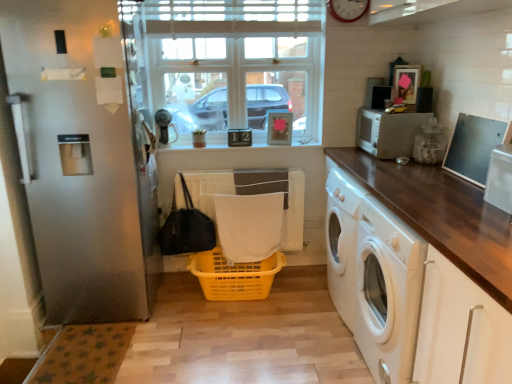
You are a GUI agent. You are given a task and a screenshot of the screen. Output one action in this format:
    pyautogui.click(x=<x>, y=<y>)
    Task: Click on the unoccupied area behind metallic silver microwave at right
    This screenshot has width=512, height=384.
    Given the screenshot: What is the action you would take?
    pyautogui.click(x=461, y=196)